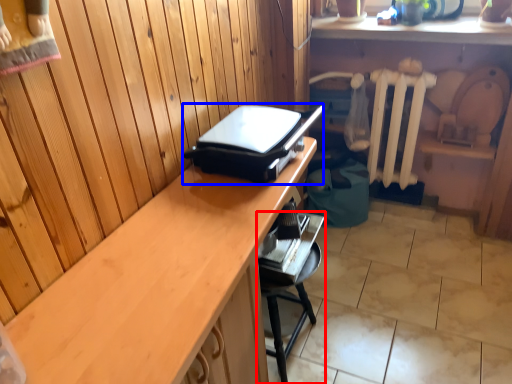
Question: Which of the following is the farthest to the observer, furniture (highlighted by a red box) or appliance (highlighted by a blue box)?

Choices:
 (A) furniture
 (B) appliance

Answer: (A)